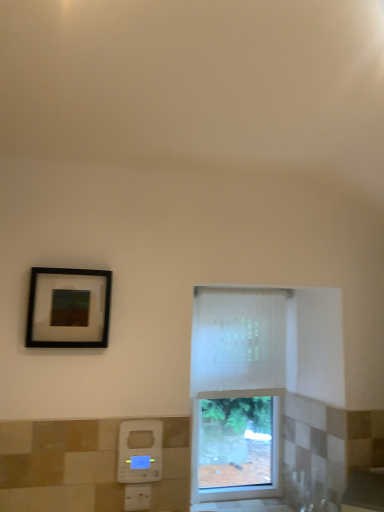
Question: From the image's perspective, does white plastic hand dryer at lower center appear lower than matte black picture frame at upper left?

Choices:
 (A) yes
 (B) no

Answer: (A)

Question: Considering the relative sizes of white plastic hand dryer at lower center and matte black picture frame at upper left in the image provided, is white plastic hand dryer at lower center thinner than matte black picture frame at upper left?

Choices:
 (A) no
 (B) yes

Answer: (B)

Question: Are white plastic hand dryer at lower center and matte black picture frame at upper left making contact?

Choices:
 (A) yes
 (B) no

Answer: (B)

Question: From the image's perspective, would you say white plastic hand dryer at lower center is positioned over matte black picture frame at upper left?

Choices:
 (A) no
 (B) yes

Answer: (A)

Question: Considering the relative sizes of white plastic hand dryer at lower center and matte black picture frame at upper left in the image provided, is white plastic hand dryer at lower center bigger than matte black picture frame at upper left?

Choices:
 (A) yes
 (B) no

Answer: (B)

Question: From a real-world perspective, is white plastic hand dryer at lower center over matte black picture frame at upper left?

Choices:
 (A) yes
 (B) no

Answer: (B)

Question: Can you confirm if matte black picture frame at upper left is wider than white sheer curtain at center?

Choices:
 (A) no
 (B) yes

Answer: (A)

Question: Considering the relative sizes of matte black picture frame at upper left and white sheer curtain at center in the image provided, is matte black picture frame at upper left shorter than white sheer curtain at center?

Choices:
 (A) yes
 (B) no

Answer: (A)

Question: Would you say white sheer curtain at center is part of matte black picture frame at upper left's contents?

Choices:
 (A) yes
 (B) no

Answer: (B)

Question: Is matte black picture frame at upper left taller than white sheer curtain at center?

Choices:
 (A) yes
 (B) no

Answer: (B)

Question: Does matte black picture frame at upper left have a larger size compared to white sheer curtain at center?

Choices:
 (A) yes
 (B) no

Answer: (B)

Question: Are matte black picture frame at upper left and white sheer curtain at center making contact?

Choices:
 (A) no
 (B) yes

Answer: (A)

Question: Considering the relative sizes of matte black picture frame at upper left and white plastic hand dryer at lower center in the image provided, is matte black picture frame at upper left wider than white plastic hand dryer at lower center?

Choices:
 (A) yes
 (B) no

Answer: (A)